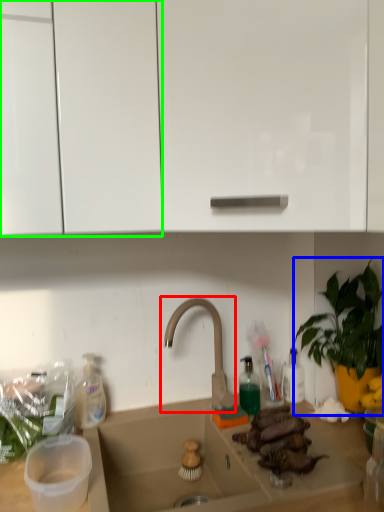
Question: Which is farther away from tap (highlighted by a red box)? houseplant (highlighted by a blue box) or cabinetry (highlighted by a green box)?

Choices:
 (A) houseplant
 (B) cabinetry

Answer: (B)